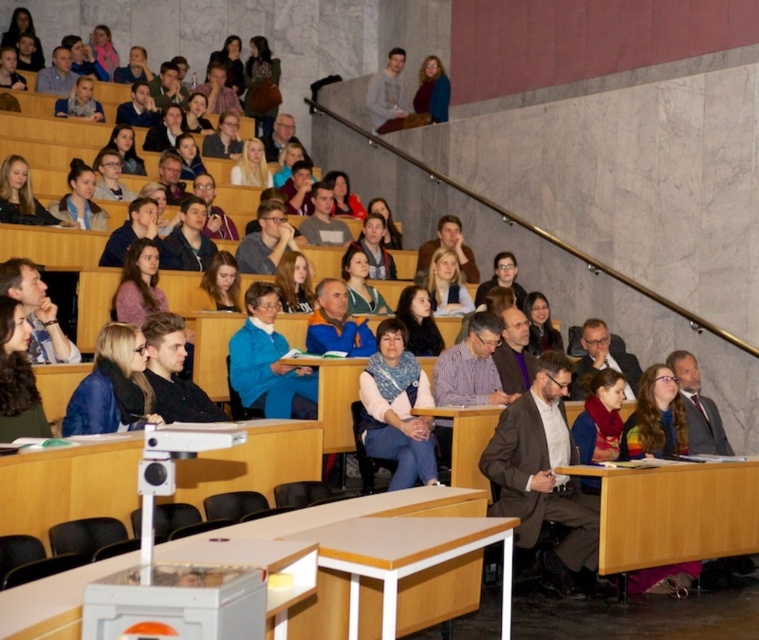
You are a photographer trying to capture a candid shot of the knitted scarf at center and the blue fabric jacket at center in the lecture hall. Since you want to ensure both items are clearly visible in the photo, which object should you focus on first to account for their sizes?

The knitted scarf at center has a larger size compared to the blue fabric jacket at center, so you should focus on the knitted scarf at center first to ensure its details are captured clearly before adjusting for the smaller blue fabric jacket at center.